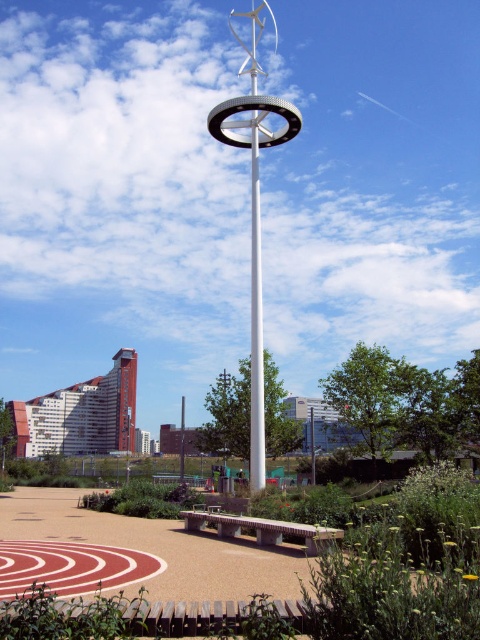
You are a visitor in the park and want to sit on the smooth concrete bench at center. From the white glossy wind turbine at center, which direction should you walk to reach the bench?

The smooth concrete bench at center is to the right of the white glossy wind turbine at center, so you should walk to the right to reach it.

You are a park visitor sitting on the smooth concrete bench at center. You want to move to the concrete textured bench at center. Which direction should you go to reach it?

The smooth concrete bench at center is in front of concrete textured bench at center, so you should move backward to reach the concrete textured bench at center.

You are planning to place a small potted plant between the smooth concrete bench at center and the concrete textured bench at center. Given that the potted plant requires 2 feet of space to grow properly, is there enough space between the two benches to accommodate it?

The smooth concrete bench at center and the concrete textured bench at center are 13.85 feet apart from each other, so yes, there is enough space between them to place the potted plant requiring 2 feet of space.